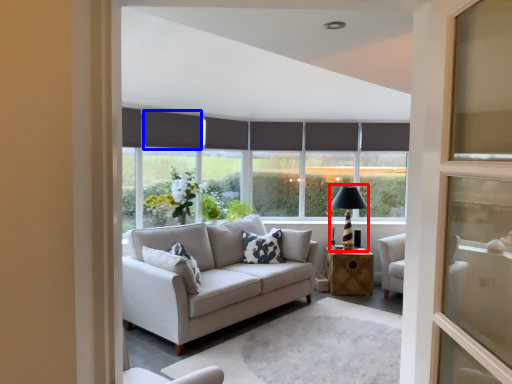
Question: Among these objects, which one is nearest to the camera, table lamp (highlighted by a red box) or curtain (highlighted by a blue box)?

Choices:
 (A) table lamp
 (B) curtain

Answer: (B)